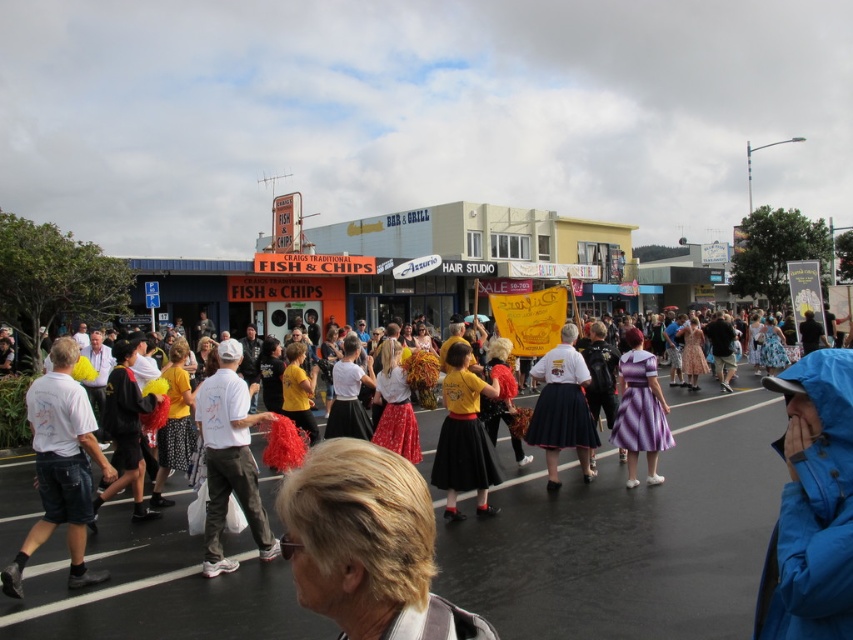
Question: Is blue waterproof jacket at lower right positioned behind white cotton t-shirt at left?

Choices:
 (A) yes
 (B) no

Answer: (B)

Question: Is blonde hair at center positioned at the back of black fabric backpack at left?

Choices:
 (A) yes
 (B) no

Answer: (B)

Question: Does white cotton shirt at center have a greater width compared to yellow fabric skirt at center?

Choices:
 (A) no
 (B) yes

Answer: (B)

Question: Which object is farther from the camera taking this photo?

Choices:
 (A) yellow fabric skirt at center
 (B) white cotton t-shirt at left
 (C) yellow fabric banner at center

Answer: (A)

Question: Which object appears closest to the camera in this image?

Choices:
 (A) matte black skirt at center
 (B) white cotton shirt at center
 (C) purple satin dress at center
 (D) yellow fabric banner at center

Answer: (D)

Question: Among these points, which one is farthest from the camera?

Choices:
 (A) [x=231, y=477]
 (B) [x=792, y=394]

Answer: (A)